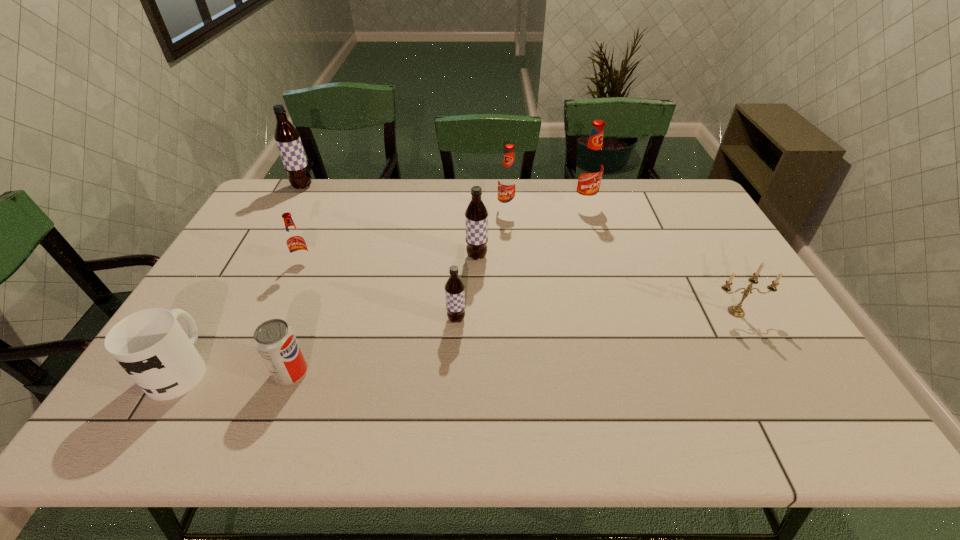
Identify the location of the leftmost root beer. The width and height of the screenshot is (960, 540). (288, 141).

You are a GUI agent. You are given a task and a screenshot of the screen. Output one action in this format:
    pyautogui.click(x=<x>, y=<y>)
    Task: Click on the leftmost brown root beer
    The height and width of the screenshot is (540, 960).
    Given the screenshot: What is the action you would take?
    pyautogui.click(x=288, y=141)

At what (x,y) coordinates should I click in order to perform the action: click on the rightmost root beer. Please return your answer as a coordinate pair (x, y). The image size is (960, 540). Looking at the image, I should click on (590, 169).

What are the coordinates of `the rightmost red root beer` in the screenshot? It's located at (590, 169).

This screenshot has height=540, width=960. I want to click on the second root beer from right to left, so click(508, 179).

At what (x,y) coordinates should I click in order to perform the action: click on the seventh object from left to right. Please return your answer as a coordinate pair (x, y). Looking at the image, I should click on (508, 179).

At what (x,y) coordinates should I click in order to perform the action: click on the second farthest brown root beer. Please return your answer as a coordinate pair (x, y). This screenshot has height=540, width=960. Looking at the image, I should click on (476, 215).

Find the location of `the leftmost red root beer`. the leftmost red root beer is located at coordinates (295, 241).

Image resolution: width=960 pixels, height=540 pixels. Find the location of `the smallest red root beer`. the smallest red root beer is located at coordinates (295, 241).

You are a GUI agent. You are given a task and a screenshot of the screen. Output one action in this format:
    pyautogui.click(x=<x>, y=<y>)
    Task: Click on the smallest brown root beer
    The height and width of the screenshot is (540, 960).
    Given the screenshot: What is the action you would take?
    pyautogui.click(x=454, y=288)